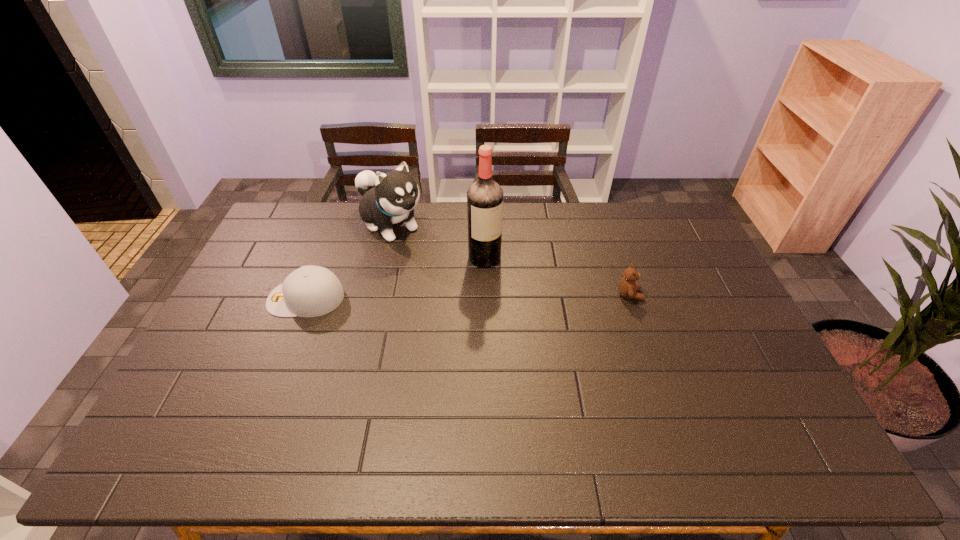
The image size is (960, 540). Find the location of `blank space at the left edge of the desktop`. blank space at the left edge of the desktop is located at coordinates (262, 323).

Find the location of a particular element. This screenshot has height=540, width=960. vacant space at the right edge is located at coordinates (684, 288).

In the image, there is a desktop. At what (x,y) coordinates should I click in order to perform the action: click on vacant space at the near right corner. Please return your answer as a coordinate pair (x, y). The width and height of the screenshot is (960, 540). Looking at the image, I should click on (776, 418).

You are a GUI agent. You are given a task and a screenshot of the screen. Output one action in this format:
    pyautogui.click(x=<x>, y=<y>)
    Task: Click on the vacant space in between the third tallest object and the second object from right to left
    
    Given the screenshot: What is the action you would take?
    pyautogui.click(x=558, y=276)

Where is `free space between the liquor and the puppy`? free space between the liquor and the puppy is located at coordinates (438, 241).

Image resolution: width=960 pixels, height=540 pixels. In order to click on vacant space that is in between the liquor and the second tallest object in this screenshot , I will do `click(438, 241)`.

You are a GUI agent. You are given a task and a screenshot of the screen. Output one action in this format:
    pyautogui.click(x=<x>, y=<y>)
    Task: Click on the free space between the second tallest object and the shortest object
    This screenshot has height=540, width=960.
    Given the screenshot: What is the action you would take?
    pyautogui.click(x=348, y=261)

The width and height of the screenshot is (960, 540). I want to click on free space that is in between the puppy and the third tallest object, so click(511, 259).

Where is `unoccupied position between the shortest object and the third tallest object`? unoccupied position between the shortest object and the third tallest object is located at coordinates (468, 296).

This screenshot has height=540, width=960. In order to click on free space between the third object from left to right and the teddy bear in this screenshot , I will do `click(558, 276)`.